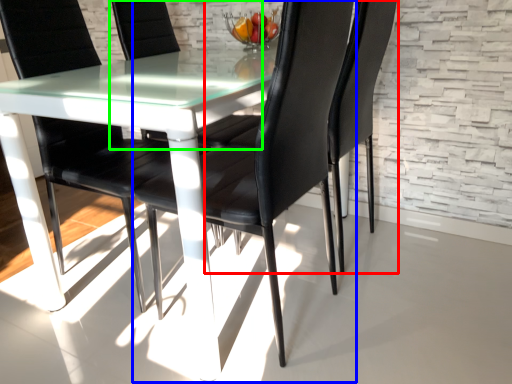
Question: Which object is the closest to the chair (highlighted by a red box)? Choose among these: chair (highlighted by a blue box) or chair (highlighted by a green box).

Choices:
 (A) chair
 (B) chair

Answer: (A)